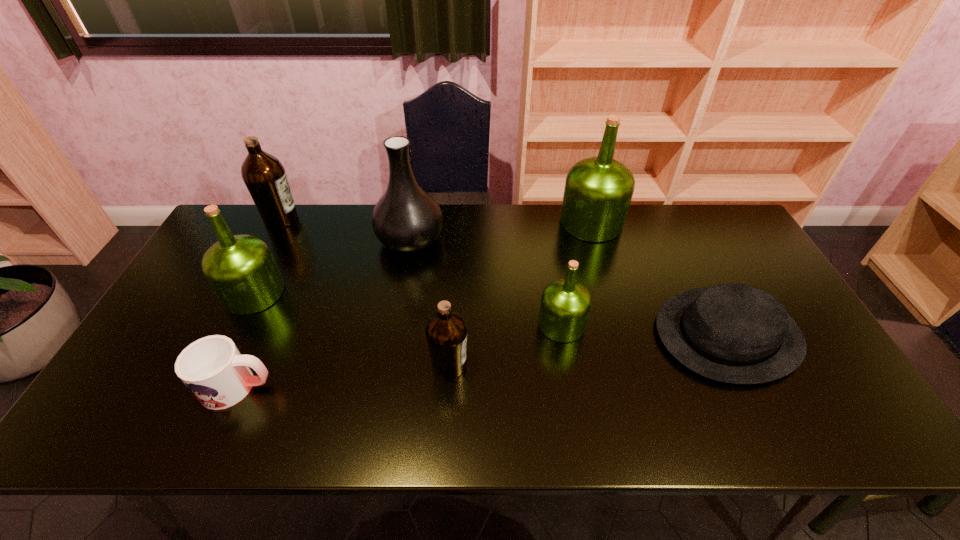
Identify the location of black fedora. Image resolution: width=960 pixels, height=540 pixels. (734, 333).

This screenshot has width=960, height=540. I want to click on vacant space located 0.180m on the front of the biggest green olive oil, so point(609,283).

Locate an element on the screen. vacant region located 0.070m on the right of the vase is located at coordinates (466, 239).

The image size is (960, 540). I want to click on free spot located 0.060m on the left of the second smallest green olive oil, so click(x=204, y=293).

Where is `vacant area situated on the label of the bigger brown olive oil`? The height and width of the screenshot is (540, 960). vacant area situated on the label of the bigger brown olive oil is located at coordinates (320, 219).

This screenshot has width=960, height=540. I want to click on free space located 0.240m on the back of the smallest green olive oil, so click(x=549, y=249).

Where is `vacant area situated 0.280m on the label of the nearest olive oil`? The width and height of the screenshot is (960, 540). vacant area situated 0.280m on the label of the nearest olive oil is located at coordinates (581, 365).

This screenshot has width=960, height=540. Find the location of `free space located on the side of the mug with the handle`. free space located on the side of the mug with the handle is located at coordinates (361, 387).

Where is `free space located on the back of the fedora`? This screenshot has width=960, height=540. free space located on the back of the fedora is located at coordinates (669, 217).

Find the location of a particular element. vase present at the far edge is located at coordinates (406, 218).